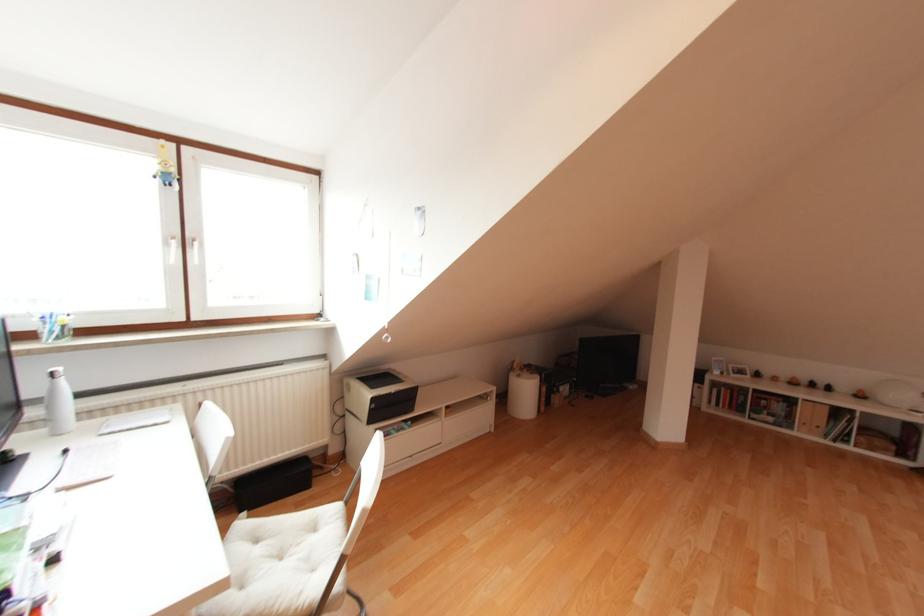
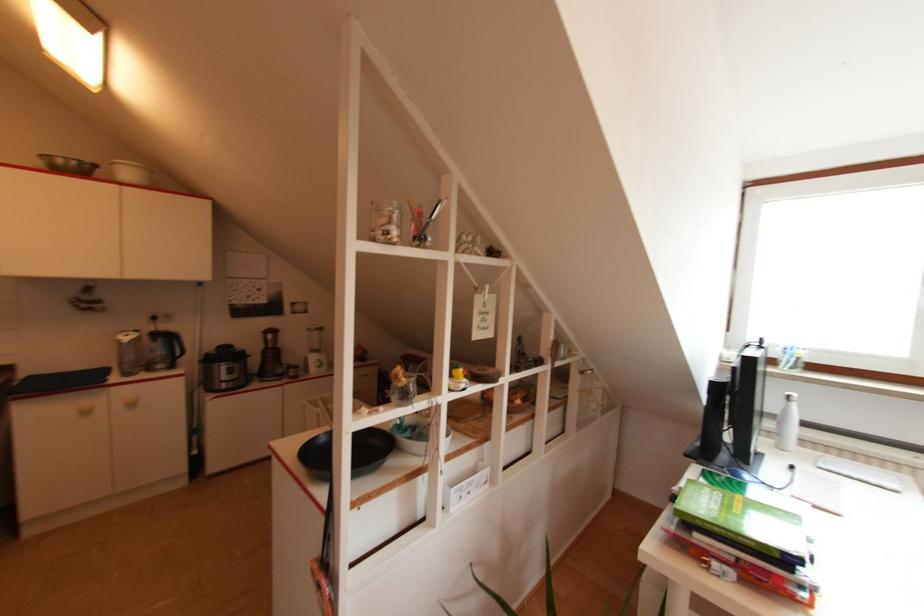
Question: The first image is from the beginning of the video and the second image is from the end. How did the camera likely rotate when shooting the video?

Choices:
 (A) Left
 (B) Right
 (C) Up
 (D) Down

Answer: (A)